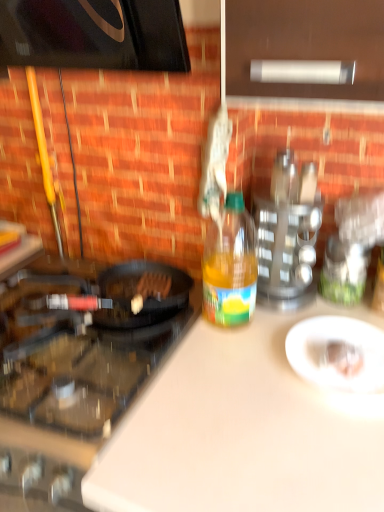
What do you see at coordinates (338, 353) in the screenshot?
I see `white glossy plate at center` at bounding box center [338, 353].

In order to face yellow translucent bottle at center, should I rotate leftwards or rightwards?

It's best to rotate right around 5.088 degrees.

Identify the location of white glossy plate at center. This screenshot has height=512, width=384. (338, 353).

In the scene shown: Which of these two, yellow translucent bottle at center or metallic silver spice rack at upper right, stands shorter?

metallic silver spice rack at upper right.

Considering the relative sizes of yellow translucent bottle at center and metallic silver spice rack at upper right in the image provided, is yellow translucent bottle at center wider than metallic silver spice rack at upper right?

Incorrect, the width of yellow translucent bottle at center does not surpass that of metallic silver spice rack at upper right.

Is yellow translucent bottle at center oriented towards metallic silver spice rack at upper right?

No, yellow translucent bottle at center does not turn towards metallic silver spice rack at upper right.

In the scene shown: Is yellow translucent bottle at center to the right of metallic silver spice rack at upper right from the viewer's perspective?

No.

From the image's perspective, is white glossy plate at center located beneath black glass gas stove at left?

No, from the image's perspective, white glossy plate at center is not beneath black glass gas stove at left.

Can you tell me how much white glossy plate at center and black glass gas stove at left differ in facing direction?

0.000284 degrees separate the facing orientations of white glossy plate at center and black glass gas stove at left.

Identify the location of gas stove below the white glossy plate at center (from a real-world perspective). This screenshot has width=384, height=512. (69, 391).

Is white matte cutting board at center wider than black glass gas stove at left?

Indeed, white matte cutting board at center has a greater width compared to black glass gas stove at left.

How many degrees apart are the facing directions of white matte cutting board at center and black glass gas stove at left?

The angle between the facing direction of white matte cutting board at center and the facing direction of black glass gas stove at left is 5.44e-05 degrees.

From a real-world perspective, is white matte cutting board at center on black glass gas stove at left?

No.

Does white matte cutting board at center turn towards white glossy plate at center?

No, white matte cutting board at center is not aimed at white glossy plate at center.

From the image's perspective, does white matte cutting board at center appear higher than white glossy plate at center?

No, from the image's perspective, white matte cutting board at center is not on top of white glossy plate at center.

Between white matte cutting board at center and white glossy plate at center, which one appears on the right side from the viewer's perspective?

→ Positioned to the right is white glossy plate at center.

Considering the sizes of white matte cutting board at center and white glossy plate at center in the image, is white matte cutting board at center wider or thinner than white glossy plate at center?

Considering their sizes, white matte cutting board at center looks broader than white glossy plate at center.

How many degrees apart are the facing directions of metallic silver spice rack at upper right and white glossy plate at center?

7.56 degrees.

Is metallic silver spice rack at upper right positioned before white glossy plate at center?

No, the depth of metallic silver spice rack at upper right is greater than that of white glossy plate at center.

Are metallic silver spice rack at upper right and white glossy plate at center beside each other?

They are not placed beside each other.

Is metallic silver spice rack at upper right positioned beyond the bounds of white glossy plate at center?

Yes, metallic silver spice rack at upper right is not within white glossy plate at center.

Locate an element on the screen. The image size is (384, 512). counter top on the right of the yellow translucent bottle at center is located at coordinates pos(243,430).

Considering the relative positions of yellow translucent bottle at center and white matte cutting board at center in the image provided, is yellow translucent bottle at center in front of white matte cutting board at center?

No, yellow translucent bottle at center is further to the viewer.

From the image's perspective, which one is positioned higher, yellow translucent bottle at center or white matte cutting board at center?

From the image's view, yellow translucent bottle at center is above.

How many degrees apart are the facing directions of white matte cutting board at center and yellow translucent bottle at center?

They differ by 1.25 degrees in their facing directions.

From a real-world perspective, is white matte cutting board at center below yellow translucent bottle at center?

Yes, from a real-world perspective, white matte cutting board at center is under yellow translucent bottle at center.

Does point (351, 489) come in front of point (226, 201)?

Yes, point (351, 489) is in front of point (226, 201).

From the image's perspective, between white matte cutting board at center and yellow translucent bottle at center, which one is located above?

yellow translucent bottle at center is shown above in the image.

You are a GUI agent. You are given a task and a screenshot of the screen. Output one action in this format:
    pyautogui.click(x=<x>, y=<y>)
    Task: Click on the bottle located on the left of metallic silver spice rack at upper right
    Image resolution: width=384 pixels, height=512 pixels.
    Given the screenshot: What is the action you would take?
    pyautogui.click(x=230, y=266)

Locate an element on the screen. plate behind the black glass gas stove at left is located at coordinates (338, 353).

Looking at the image, which one is located further to white glossy plate at center, white matte cutting board at center or yellow translucent bottle at center?

yellow translucent bottle at center.

Which object lies nearer to the anchor point white glossy plate at center, white matte cutting board at center or black glass gas stove at left?

The object closer to white glossy plate at center is white matte cutting board at center.

Based on their spatial positions, is white matte cutting board at center or white glossy plate at center closer to black glass gas stove at left?

Based on the image, white matte cutting board at center appears to be nearer to black glass gas stove at left.

Based on their spatial positions, is metallic silver spice rack at upper right or white matte cutting board at center further from yellow translucent bottle at center?

white matte cutting board at center is further to yellow translucent bottle at center.

From the image, which object appears to be nearer to metallic silver spice rack at upper right, yellow translucent bottle at center or black glass gas stove at left?

Based on the image, yellow translucent bottle at center appears to be nearer to metallic silver spice rack at upper right.

Looking at the image, which one is located further to white glossy plate at center, black glass gas stove at left or metallic silver spice rack at upper right?

Among the two, black glass gas stove at left is located further to white glossy plate at center.

Considering their positions, is metallic silver spice rack at upper right positioned closer to black glass gas stove at left than white matte cutting board at center?

white matte cutting board at center lies closer to black glass gas stove at left than the other object.

Which object lies further to the anchor point yellow translucent bottle at center, metallic silver spice rack at upper right or black glass gas stove at left?

The object further to yellow translucent bottle at center is black glass gas stove at left.

This screenshot has width=384, height=512. What are the coordinates of `bottle between black glass gas stove at left and white glossy plate at center from left to right` in the screenshot? It's located at (230, 266).

Locate an element on the screen. This screenshot has width=384, height=512. plate between yellow translucent bottle at center and white matte cutting board at center vertically is located at coordinates (338, 353).

Locate an element on the screen. The width and height of the screenshot is (384, 512). appliance located between black glass gas stove at left and white glossy plate at center in the left-right direction is located at coordinates (287, 232).

In order to click on bottle situated between black glass gas stove at left and metallic silver spice rack at upper right from left to right in this screenshot , I will do `click(230, 266)`.